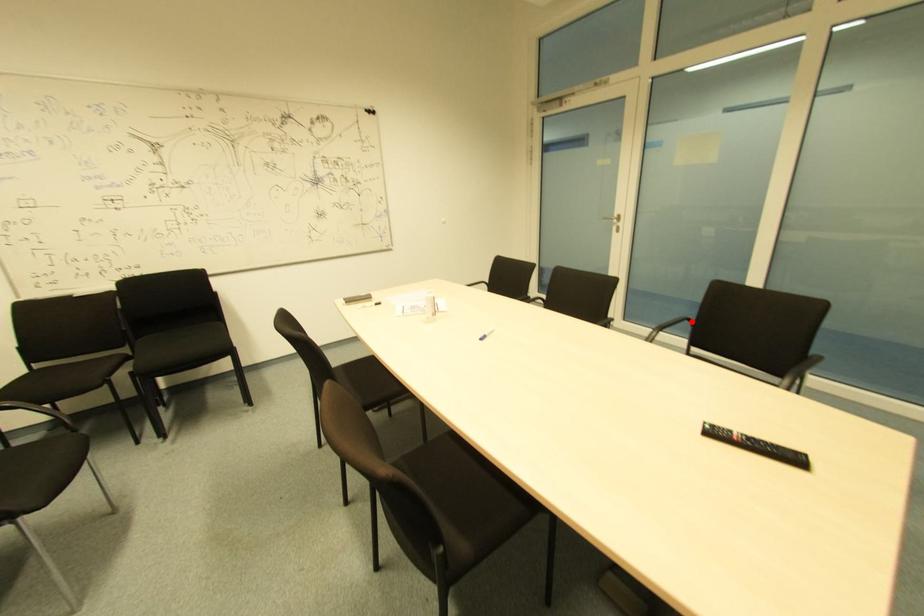
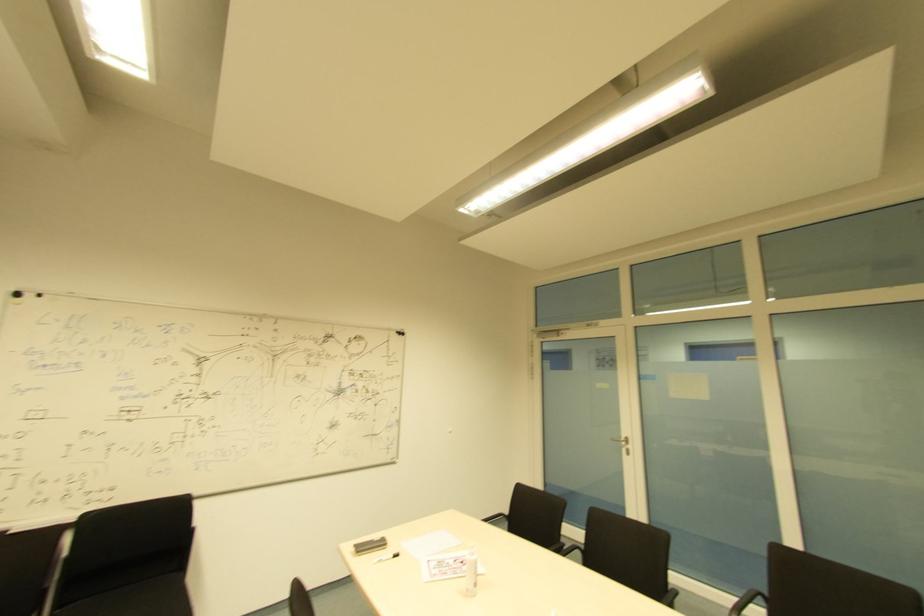
Question: A red point is marked in image1. In image2, is the corresponding 3D point closer to the camera or farther? Reply with the corresponding letter.

Choices:
 (A) The corresponding 3D point is closer.
 (B) The corresponding 3D point is farther.

Answer: (A)